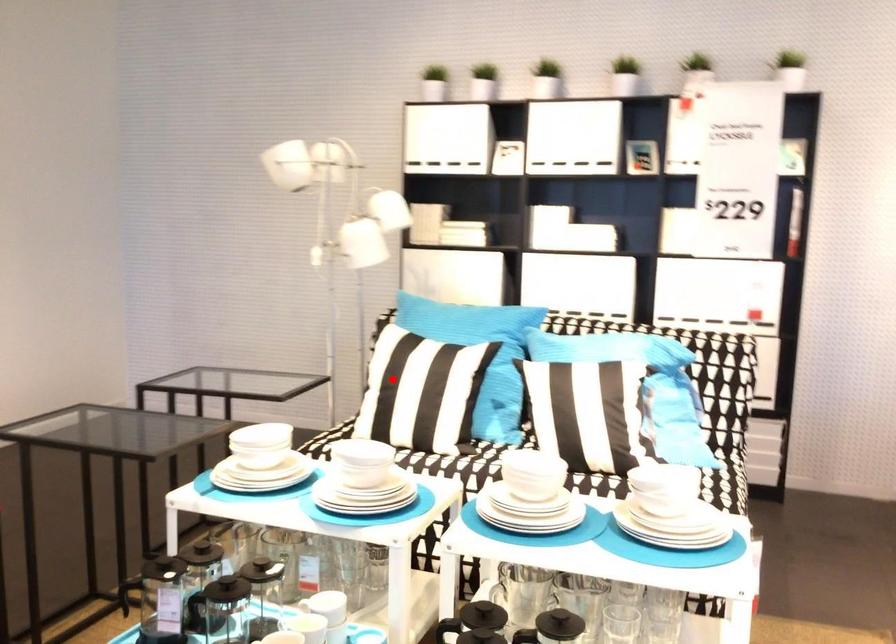
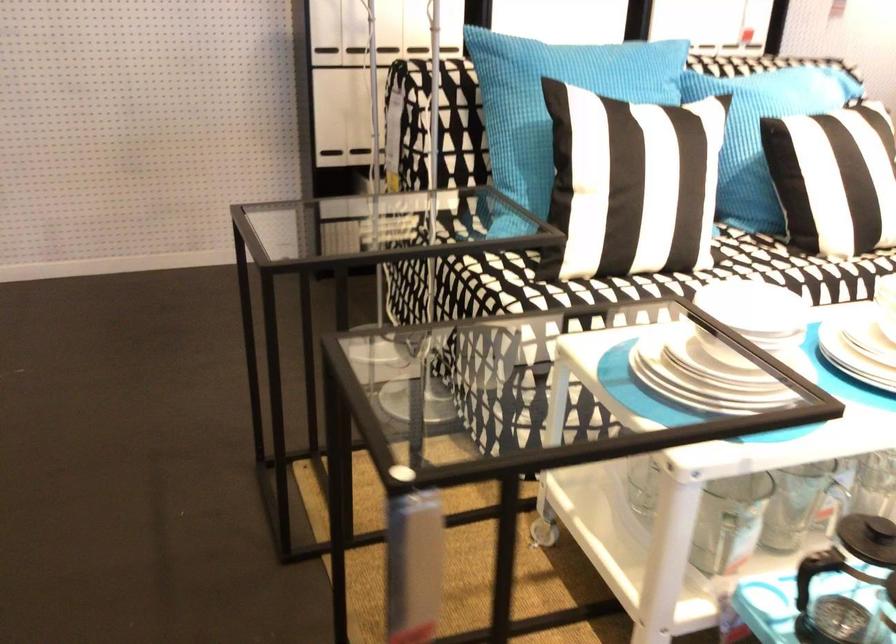
Question: I am providing you with two images of the same scene from different viewpoints. Image1 has a red point marked. In image2, the corresponding 3D location appears at what relative position? Reply with the corresponding letter.

Choices:
 (A) Closer
 (B) Farther

Answer: (A)